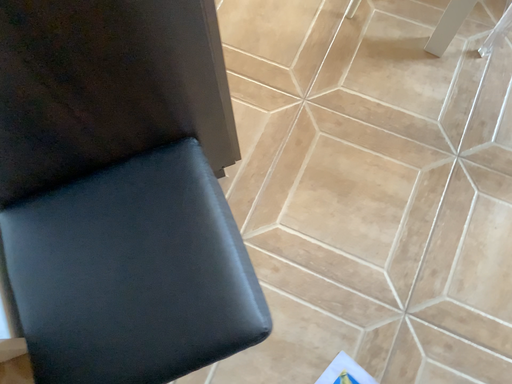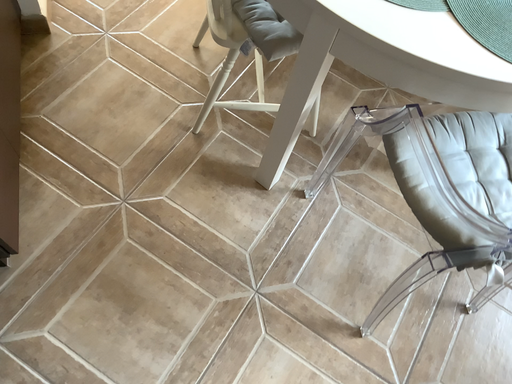
Question: How did the camera likely rotate when shooting the video?

Choices:
 (A) rotated left
 (B) rotated right

Answer: (B)